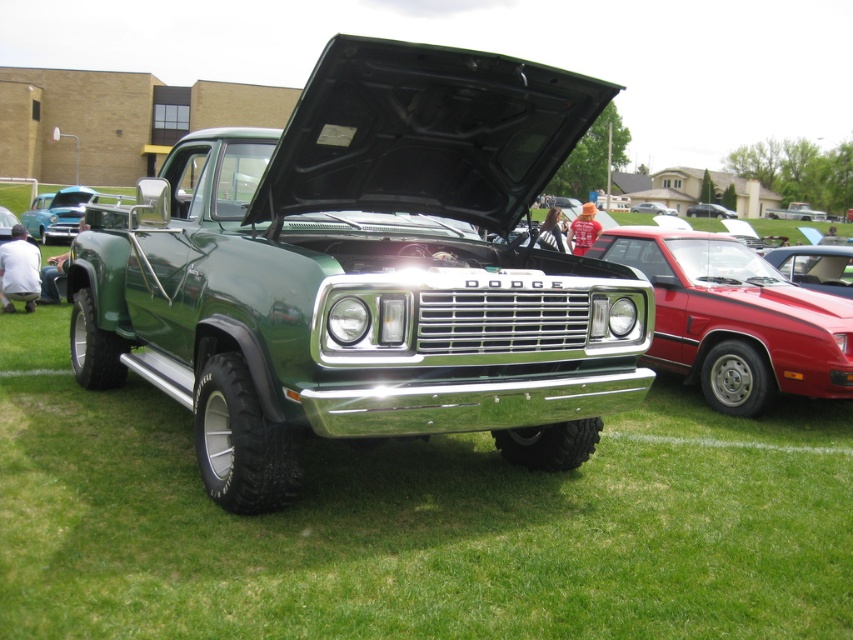
You are a photographer trying to capture both the shiny red car at center and the metallic silver sedan at center in a single frame. Given that your camera has a fixed focal length, which car should you position closer to the camera to ensure both fit in the frame without cropping?

Since the shiny red car at center is narrower than the metallic silver sedan at center, you should position the metallic silver sedan at center closer to the camera. This way, its larger width will be scaled down in the frame, allowing both vehicles to fit without cropping.

You are a photographer at a car show and want to capture both the shiny red car at center and the teal glossy sedan at center in a single shot. However, you can only focus on one vehicle at a time. Which vehicle should you focus on to ensure the other remains in the background?

You should focus on the shiny red car at center because it is in front of the teal glossy sedan at center, so the teal glossy sedan at center will naturally be in the background.

You are a photographer at a car show. You have a camera with a 1.5 meter wide lens. You want to capture both the shiny red car at center and the teal glossy sedan at center in a single shot. Can you fit both vehicles side by side within the camera lens width?

The shiny red car at center is thinner than the teal glossy sedan at center. Adding their widths together would exceed the 1.5 meter lens width, so they cannot both fit side by side within the camera lens width.